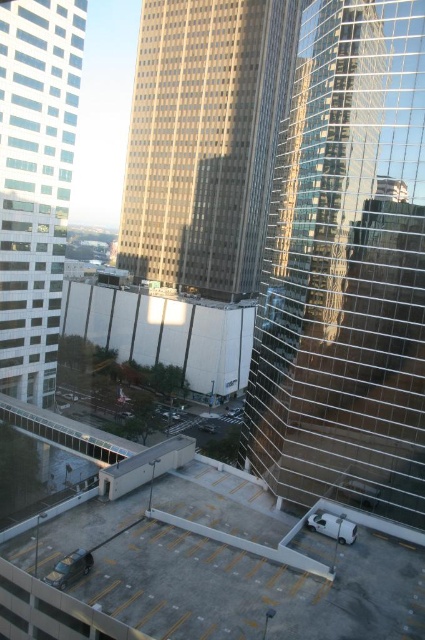
This screenshot has height=640, width=425. I want to click on gold glass skyscraper at center, so click(x=204, y=140).

The height and width of the screenshot is (640, 425). Find the location of `gold glass skyscraper at center`. gold glass skyscraper at center is located at coordinates (204, 140).

Between white glass building at left and white matte parking garage at center, which one has more height?

white glass building at left is taller.

Who is more distant from viewer, (70, 113) or (232, 352)?

The point (232, 352) is more distant.

Is point (33, 252) more distant than point (209, 349)?

No, it is in front of (209, 349).

This screenshot has height=640, width=425. In order to click on white glass building at left in this screenshot , I will do `click(36, 182)`.

Can you confirm if reflective glass tower at right is thinner than white glass building at left?

No.

This screenshot has width=425, height=640. In order to click on reflective glass tower at right in this screenshot , I will do `click(345, 269)`.